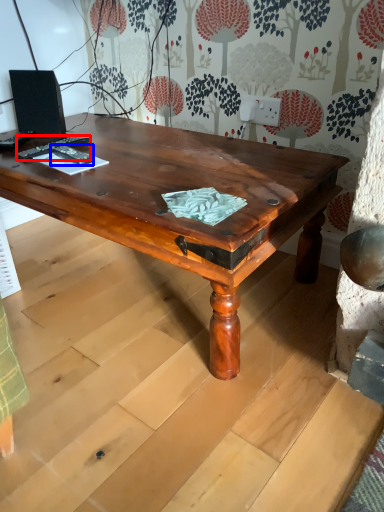
Question: Which object is further to the camera taking this photo, remote control (highlighted by a red box) or remote control (highlighted by a blue box)?

Choices:
 (A) remote control
 (B) remote control

Answer: (A)